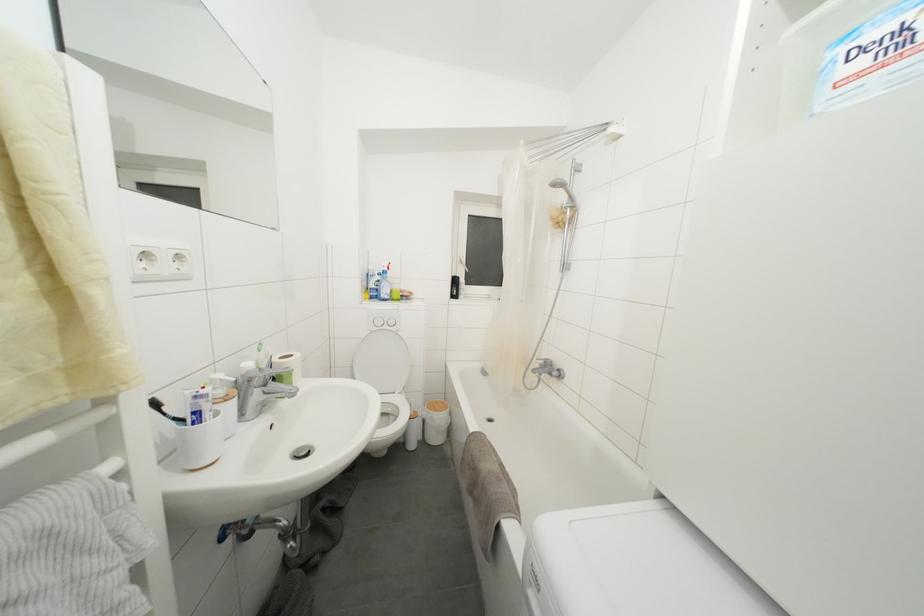
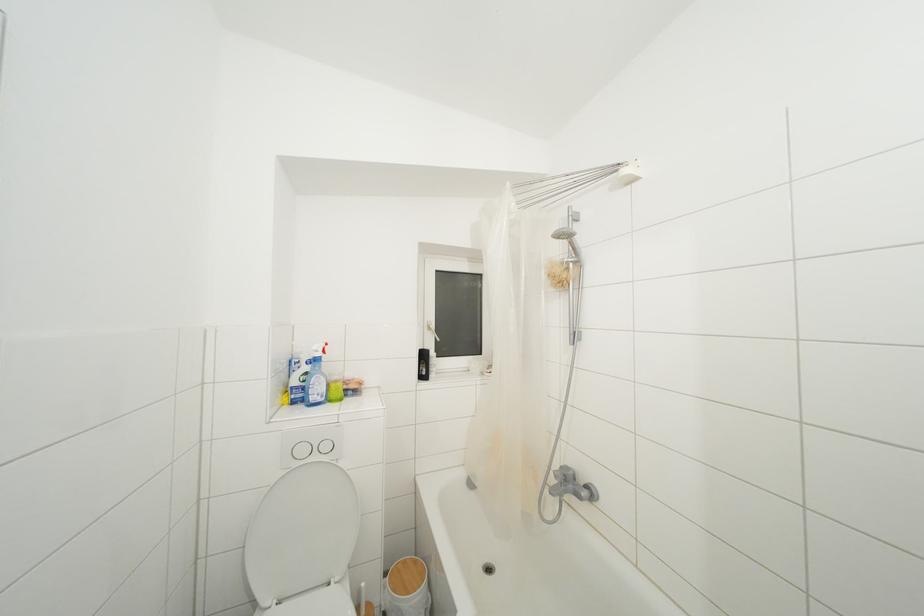
Where in the second image is the point corresponding to the point at 390,331 from the first image?

(320, 463)